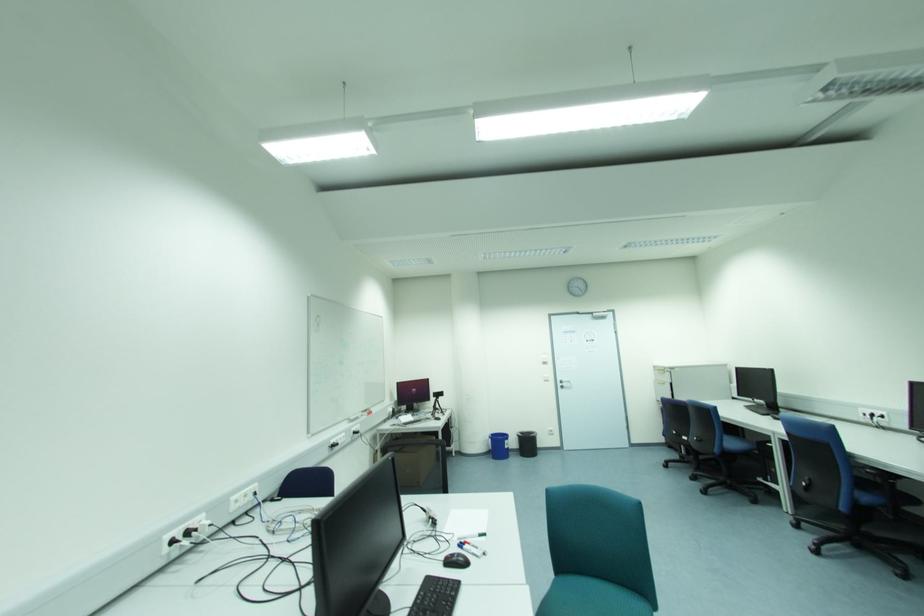
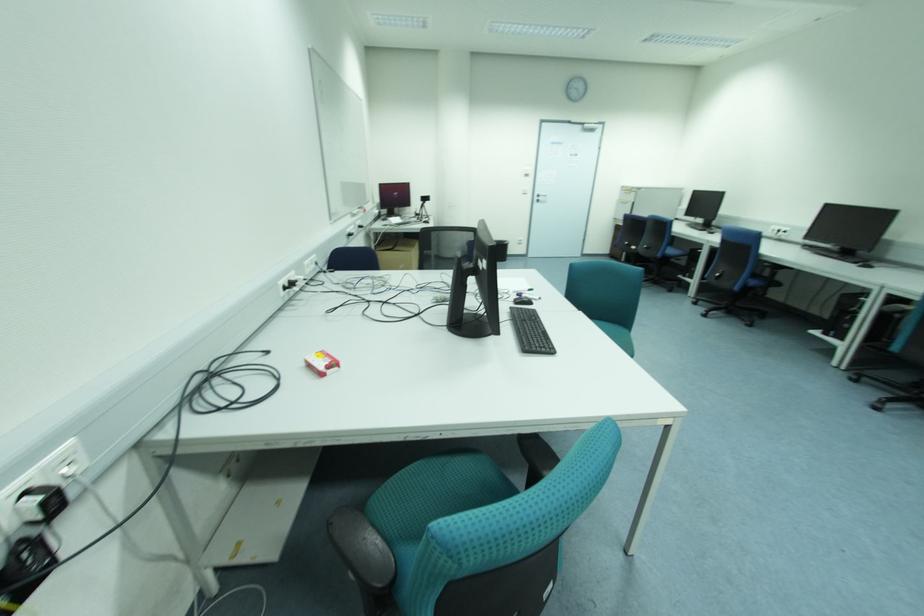
Question: The images are taken continuously from a first-person perspective. In which direction is your viewpoint rotating?

Choices:
 (A) Left
 (B) Right
 (C) Up
 (D) Down

Answer: (D)